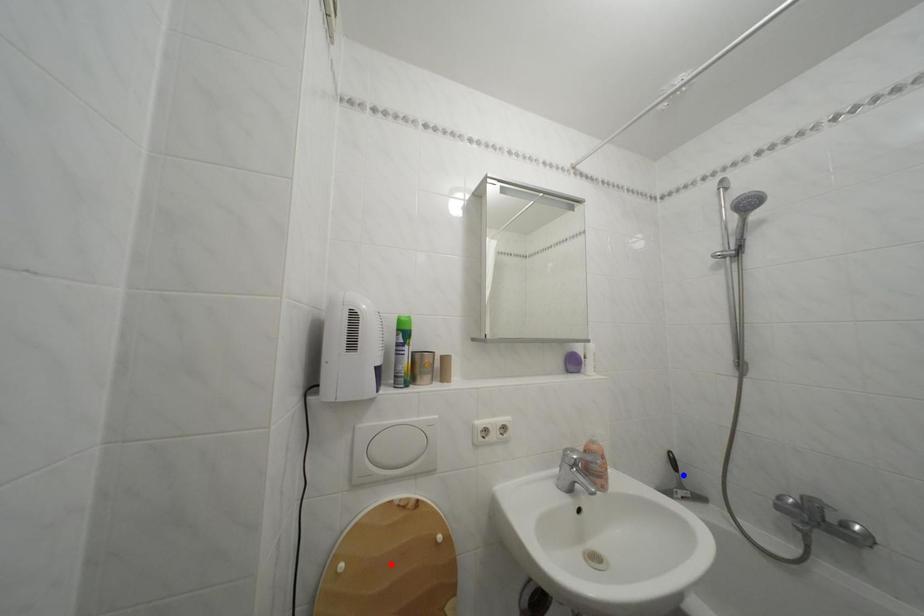
Question: Which of the two points in the image is closer to the camera?

Choices:
 (A) Blue point is closer.
 (B) Red point is closer.

Answer: (B)